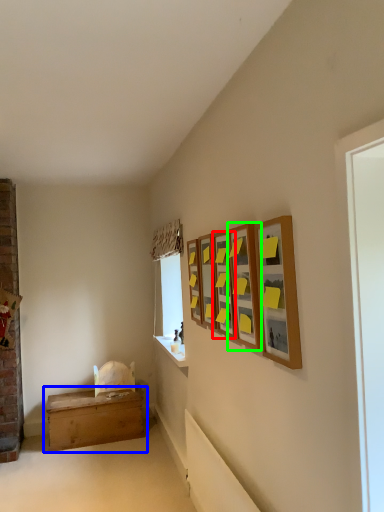
Question: Based on their relative distances, which object is farther from picture frame (highlighted by a red box)? Choose from table (highlighted by a blue box) and picture frame (highlighted by a green box).

Choices:
 (A) table
 (B) picture frame

Answer: (A)